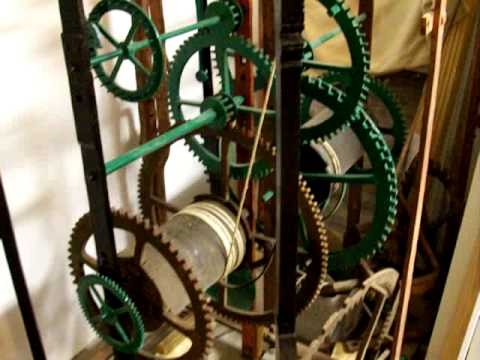
I want to click on bar, so click(x=186, y=29).